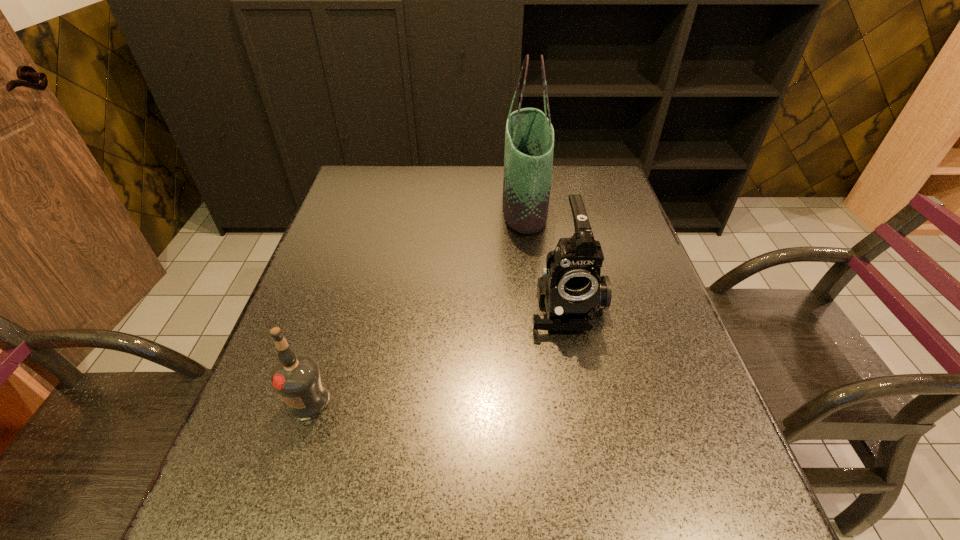
This screenshot has height=540, width=960. I want to click on object that is at the right edge, so click(571, 288).

What are the coordinates of `vacant region at the far edge of the desktop` in the screenshot? It's located at (458, 166).

Where is `free space at the left edge of the desktop`? The height and width of the screenshot is (540, 960). free space at the left edge of the desktop is located at coordinates (275, 410).

The image size is (960, 540). I want to click on vacant region at the right edge of the desktop, so click(x=647, y=354).

In the image, there is a desktop. At what (x,y) coordinates should I click in order to perform the action: click on vacant space at the far left corner. Please return your answer as a coordinate pair (x, y). Looking at the image, I should click on (367, 201).

This screenshot has height=540, width=960. In order to click on blank space at the far right corner of the desktop in this screenshot , I will do `click(590, 196)`.

Where is `free space between the vodka and the farthest object`? free space between the vodka and the farthest object is located at coordinates (416, 303).

Where is `vacant area that lies between the second nearest object and the tallest object`? vacant area that lies between the second nearest object and the tallest object is located at coordinates (545, 255).

Find the location of a particular element. The height and width of the screenshot is (540, 960). unoccupied position between the camcorder and the nearest object is located at coordinates (437, 352).

Identify the location of vacant region between the tote bag and the camcorder. Image resolution: width=960 pixels, height=540 pixels. (545, 255).